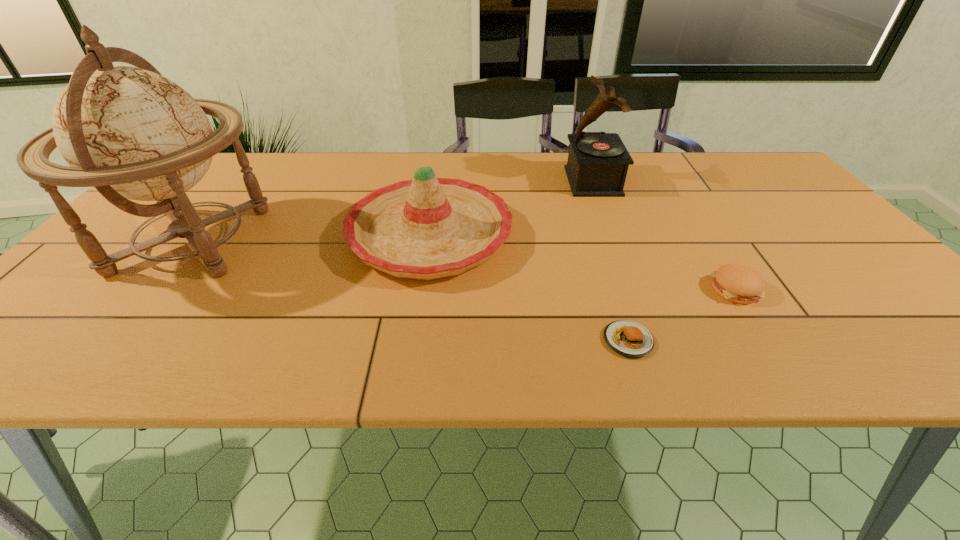
Image resolution: width=960 pixels, height=540 pixels. I want to click on vacant region located 0.200m at the horn opening of the second tallest object, so click(499, 181).

Locate an element on the screen. free space located 0.280m at the horn opening of the second tallest object is located at coordinates (472, 181).

I want to click on vacant area located 0.230m at the horn opening of the second tallest object, so click(x=490, y=181).

Identify the location of vacant space positioned on the left of the third tallest object. (287, 235).

This screenshot has height=540, width=960. Find the location of `free spot located 0.180m on the right of the fourth tallest object`. free spot located 0.180m on the right of the fourth tallest object is located at coordinates (843, 289).

This screenshot has width=960, height=540. Identify the location of free spot located on the back of the left food. (587, 214).

In order to click on object that is at the far edge in this screenshot , I will do `click(597, 165)`.

Identify the location of object that is at the near edge. Image resolution: width=960 pixels, height=540 pixels. (627, 338).

Find the location of `object at the left edge`. object at the left edge is located at coordinates (131, 133).

Identify the location of vacant space at the far edge. The image size is (960, 540). (660, 182).